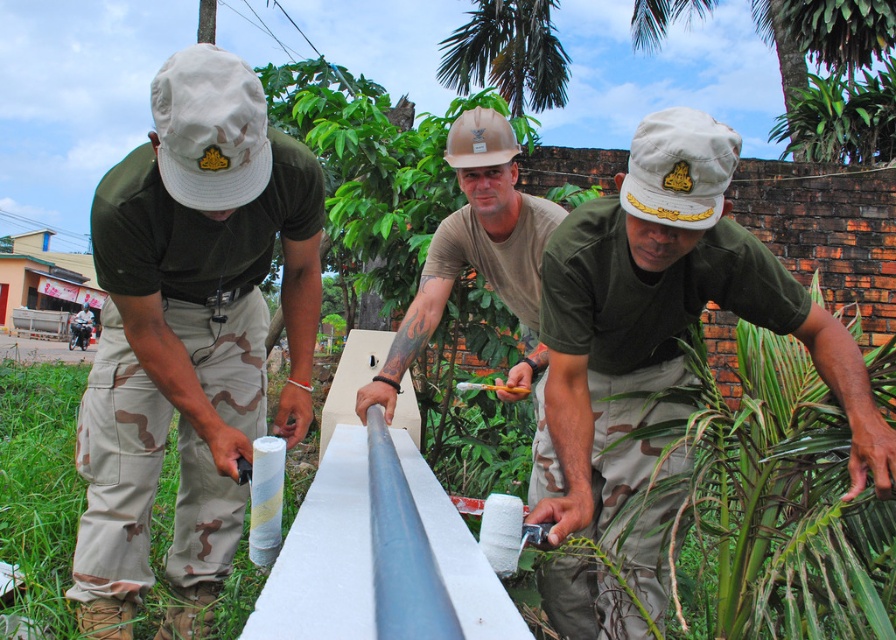
Question: Where is matte khaki uniform at center located in relation to matte brown helmet at center in the image?

Choices:
 (A) below
 (B) above

Answer: (A)

Question: Can you confirm if matte khaki uniform at center is thinner than matte brown helmet at center?

Choices:
 (A) no
 (B) yes

Answer: (A)

Question: Is matte khaki uniform at center thinner than green matte uniform at center?

Choices:
 (A) yes
 (B) no

Answer: (A)

Question: Which of the following is the closest to the observer?

Choices:
 (A) (248, 152)
 (B) (536, 212)
 (C) (705, 259)

Answer: (A)

Question: Which point is farther to the camera?

Choices:
 (A) matte brown helmet at center
 (B) matte khaki uniform at center
 (C) green matte uniform at center

Answer: (A)

Question: Which object is the farthest from the matte khaki uniform at center?

Choices:
 (A) green matte uniform at center
 (B) matte brown helmet at center

Answer: (A)